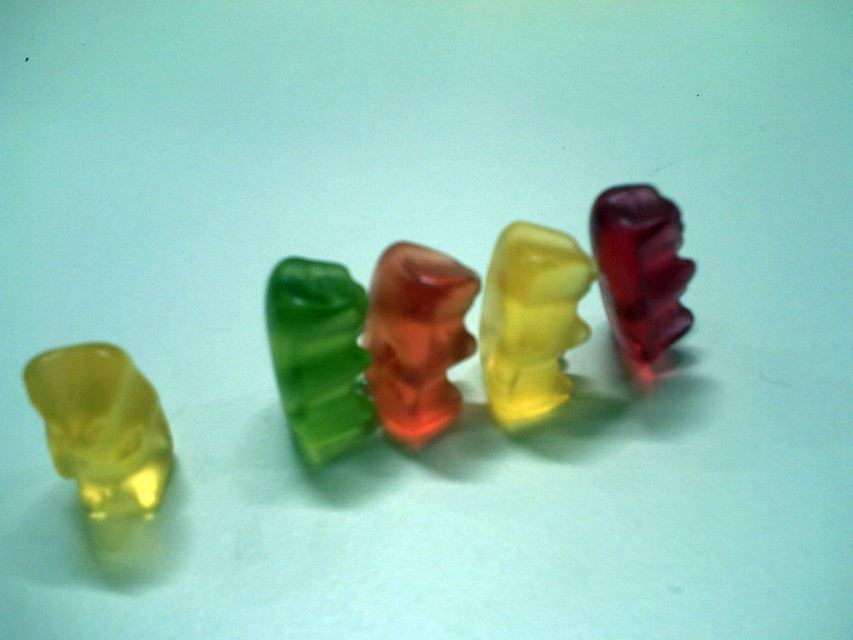
You are standing in front of a display of gummy bears arranged in a row. There is a specific point at coordinates point (x=270, y=272). If you are 1.26 meters away from this point, can you comfortably reach it without moving your feet?

The point (x=270, y=272) is 1.26 meters away from the viewer. Since the average comfortable reaching distance without moving is about 0.5 to 1 meter, it might be a bit too far to reach comfortably without taking a step forward.

You are a child looking at the gummy bears on the table. You want to pick up the green translucent bear at center. Where should you reach to grab it?

You should reach to the point at coordinates (x=318, y=355) to grab the green translucent bear at center.

You are standing at a point 4.43 feet away from the camera. You see the point labeled as point (x=444, y=401) in the image. Is this point closer to the camera than where you are standing?

The point (x=444, y=401) is 4.43 feet away from the camera, so if you are standing at a point 4.43 feet away from the camera, then the point (x=444, y=401) is exactly at your current position. Therefore, it is not closer than where you are standing.